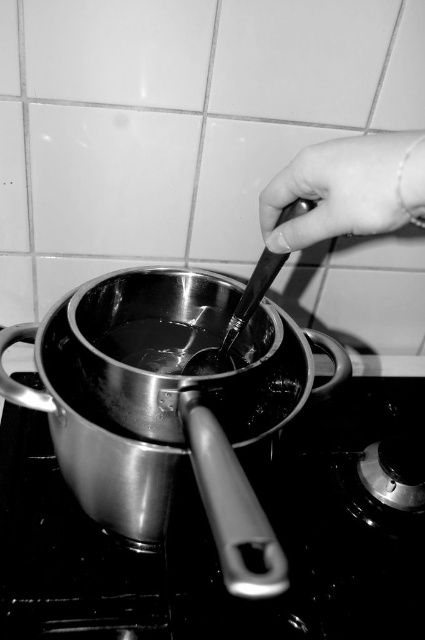
Question: Estimate the real-world distances between objects in this image. Which object is closer to the metallic gas stove at center?

Choices:
 (A) metallic at upper right
 (B) black matte spoon at center

Answer: (B)

Question: Does metallic gas stove at center lie behind black matte spoon at center?

Choices:
 (A) yes
 (B) no

Answer: (A)

Question: Which is farther from the metallic at upper right?

Choices:
 (A) black matte spoon at center
 (B) metallic gas stove at center

Answer: (B)

Question: Can you confirm if metallic gas stove at center is positioned to the right of metallic at upper right?

Choices:
 (A) no
 (B) yes

Answer: (A)

Question: Which of the following is the farthest from the observer?

Choices:
 (A) metallic at upper right
 (B) metallic gas stove at center

Answer: (B)

Question: Is metallic gas stove at center positioned in front of black matte spoon at center?

Choices:
 (A) no
 (B) yes

Answer: (A)